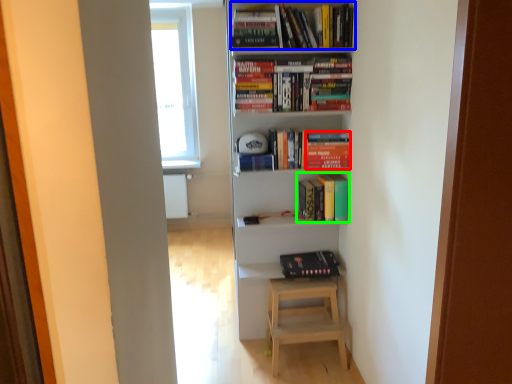
Question: Which object is the farthest from paperback book (highlighted by a red box)? Choose among these: book (highlighted by a blue box) or book (highlighted by a green box).

Choices:
 (A) book
 (B) book

Answer: (A)